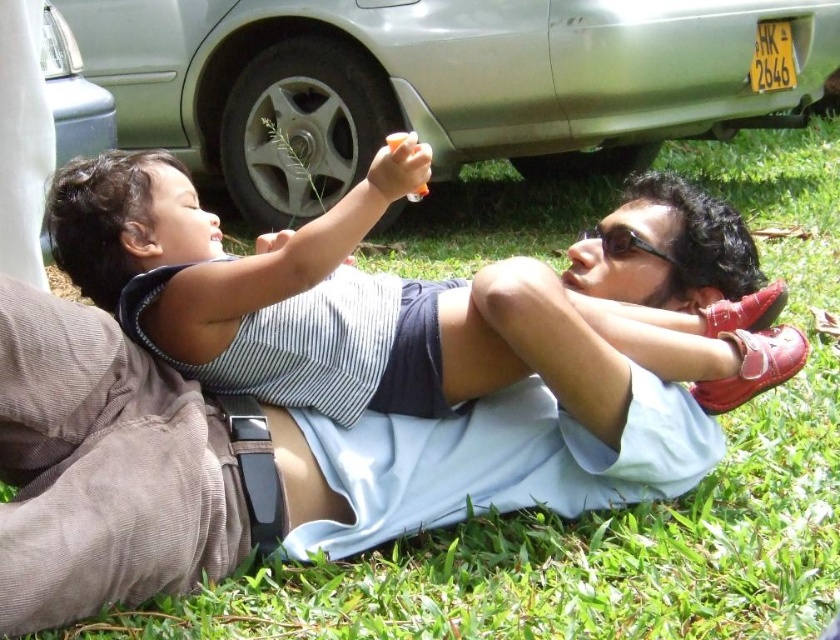
Who is positioned more to the left, silver metallic car at upper left or orange plastic bottle at center?

silver metallic car at upper left

Image resolution: width=840 pixels, height=640 pixels. What do you see at coordinates (72, 93) in the screenshot?
I see `silver metallic car at upper left` at bounding box center [72, 93].

This screenshot has height=640, width=840. Find the location of `silver metallic car at upper left`. silver metallic car at upper left is located at coordinates (72, 93).

Does black plastic goggles at upper center appear on the left side of orange plastic bottle at center?

No, black plastic goggles at upper center is not to the left of orange plastic bottle at center.

Is point (607, 241) farther from camera compared to point (402, 138)?

Yes, it is.

Where is `black plastic goggles at upper center`? black plastic goggles at upper center is located at coordinates (623, 243).

Looking at this image, is silver metallic car at upper center smaller than silver metallic car at upper left?

Incorrect, silver metallic car at upper center is not smaller in size than silver metallic car at upper left.

Who is more distant from viewer, [96,81] or [63,67]?

The point [96,81] is more distant.

Where is `silver metallic car at upper center`? Image resolution: width=840 pixels, height=640 pixels. silver metallic car at upper center is located at coordinates (442, 83).